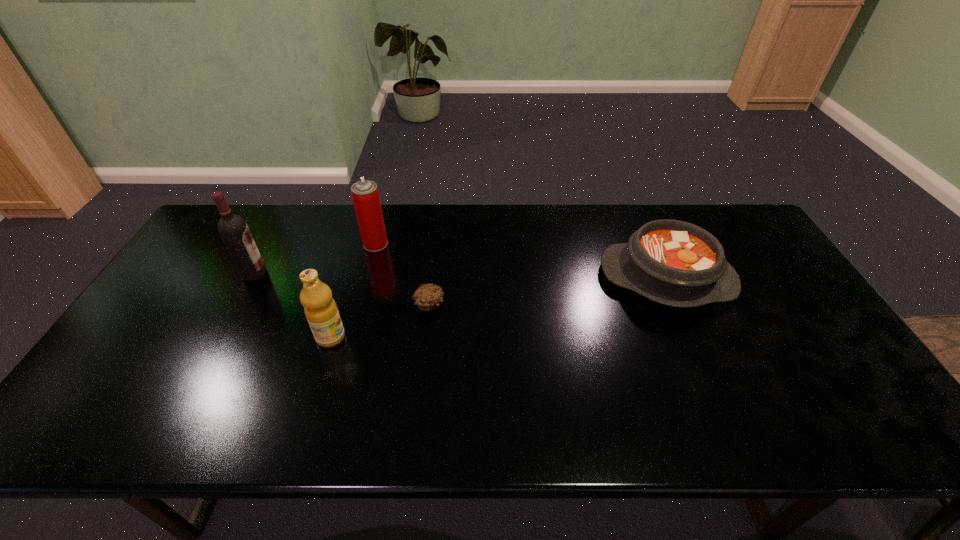
The width and height of the screenshot is (960, 540). Find the location of `free space located 0.240m on the front of the casserole`. free space located 0.240m on the front of the casserole is located at coordinates (716, 393).

Find the location of `blank area located 0.050m on the left of the shortest object`. blank area located 0.050m on the left of the shortest object is located at coordinates (396, 305).

At what (x,y) coordinates should I click in order to perform the action: click on aerosol can that is at the far edge. Please return your answer as a coordinate pair (x, y). This screenshot has height=540, width=960. Looking at the image, I should click on (365, 194).

Locate an element on the screen. casserole that is at the far edge is located at coordinates (675, 263).

Image resolution: width=960 pixels, height=540 pixels. Find the location of `vacant area at the far edge of the desktop`. vacant area at the far edge of the desktop is located at coordinates (315, 237).

The image size is (960, 540). Identify the location of free spot at the near edge of the desktop. (442, 425).

Find the location of a particular element. The width and height of the screenshot is (960, 540). blank space at the right edge of the desktop is located at coordinates (743, 281).

The image size is (960, 540). In order to click on vacant space at the far left corner in this screenshot , I will do [x=254, y=208].

I want to click on vacant area that lies between the aerosol can and the muffin, so click(402, 274).

The image size is (960, 540). Identify the location of free point between the aerosol can and the second object from right to left. (402, 274).